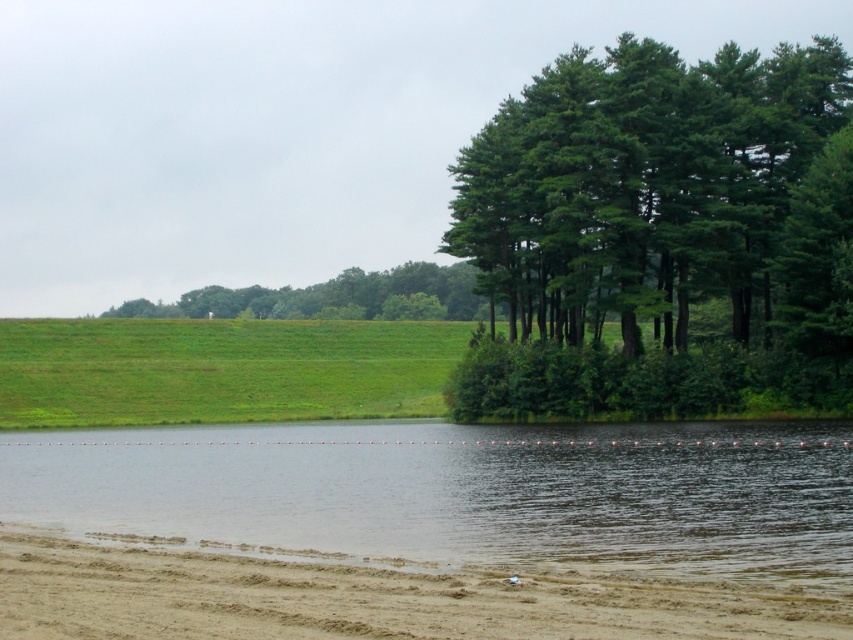
Question: Which of these objects is positioned closest to the clear water at lower center?

Choices:
 (A) green leafy trees at right
 (B) green leafy tree at center
 (C) brown sandy dirt track at lower left

Answer: (A)

Question: Does brown sandy dirt track at lower left appear on the right side of green leafy tree at center?

Choices:
 (A) yes
 (B) no

Answer: (A)

Question: Can you confirm if clear water at lower center is wider than green leafy tree at center?

Choices:
 (A) yes
 (B) no

Answer: (B)

Question: Which object appears closest to the camera in this image?

Choices:
 (A) green leafy trees at right
 (B) green leafy tree at center

Answer: (A)

Question: Is brown sandy dirt track at lower left to the right of green leafy tree at center from the viewer's perspective?

Choices:
 (A) yes
 (B) no

Answer: (A)

Question: Estimate the real-world distances between objects in this image. Which object is farther from the green leafy trees at right?

Choices:
 (A) green leafy tree at center
 (B) clear water at lower center

Answer: (A)